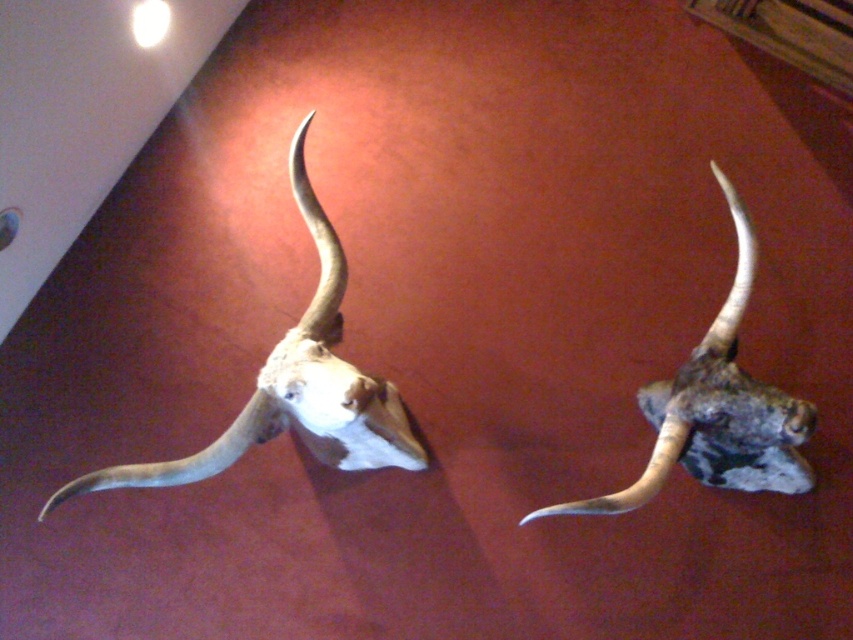
You are an interior designer planning to place a rectangular shelf between the white bone skull at center and the rustic wood moose head at right. The shelf must be exactly 1.2 meters wide. Can the shelf fit between them without overlapping either object?

The white bone skull at center might be wider than rustic wood moose head at right. Since the shelf needs to be 1.2 meters wide and the exact width of the skulls isn